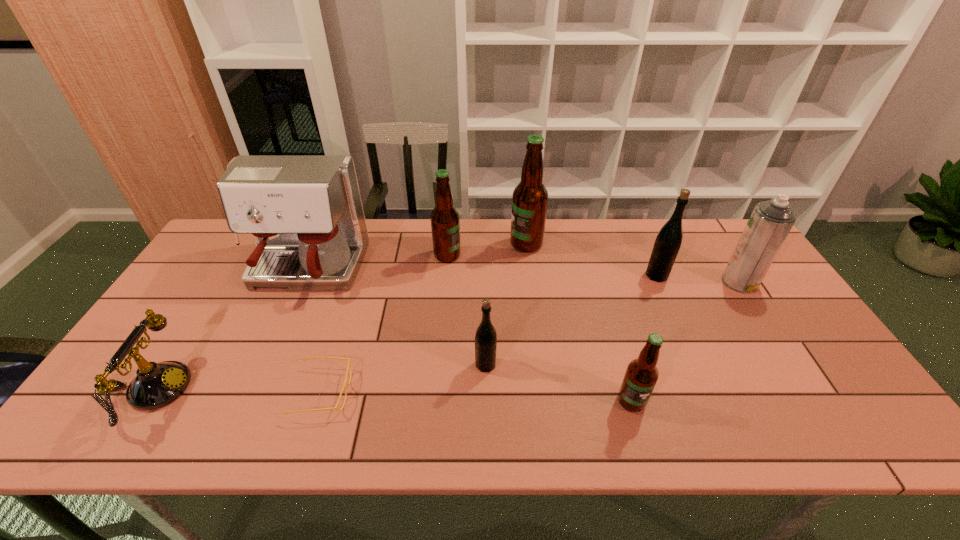
At what (x,y) coordinates should I click in order to perform the action: click on the third beer bottle from right to left. Please return your answer as a coordinate pair (x, y). Looking at the image, I should click on (530, 197).

You are a GUI agent. You are given a task and a screenshot of the screen. Output one action in this format:
    pyautogui.click(x=<x>, y=<y>)
    Task: Click on the tallest beer bottle
    
    Given the screenshot: What is the action you would take?
    pyautogui.click(x=530, y=197)

In order to click on coffee maker in this screenshot , I will do pos(305,212).

Where is `the fourth object from left to right`? the fourth object from left to right is located at coordinates (445, 223).

Locate an element on the screen. This screenshot has width=960, height=540. the leftmost beer bottle is located at coordinates (445, 223).

The width and height of the screenshot is (960, 540). In order to click on the third nearest beer bottle in this screenshot , I will do `click(668, 241)`.

The height and width of the screenshot is (540, 960). I want to click on the bigger green beer bottle, so click(668, 241).

Identify the location of aerosol can. (771, 221).

Find the location of a particular element. This screenshot has height=540, width=960. the seventh object from left to right is located at coordinates (641, 375).

Locate an element on the screen. The width and height of the screenshot is (960, 540). the smallest brown beer bottle is located at coordinates (641, 375).